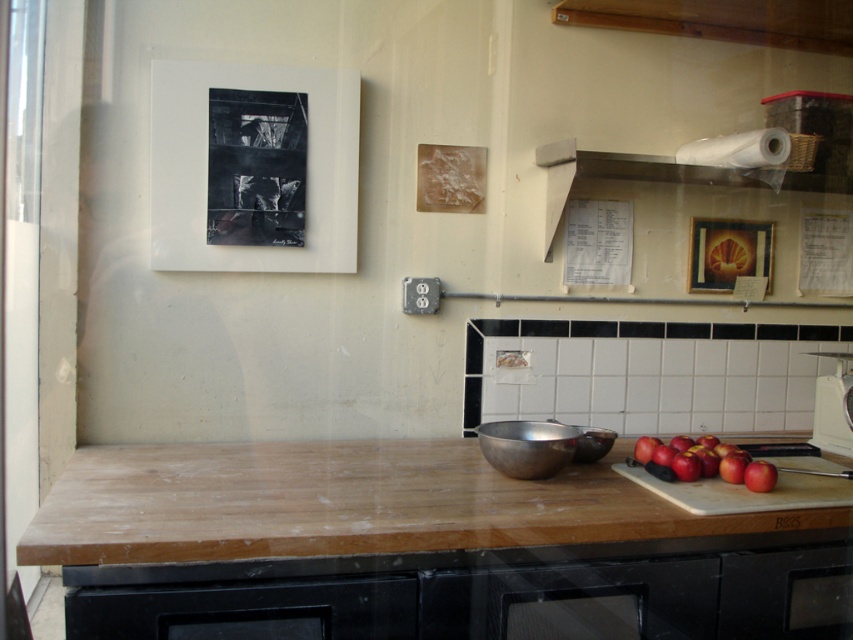
Can you confirm if red matte apples at lower right is taller than red matte apple at lower right?

Yes.

Can you confirm if red matte apples at lower right is positioned above red matte apple at lower right?

Indeed, red matte apples at lower right is positioned over red matte apple at lower right.

Does point (654, 445) come farther from viewer compared to point (752, 484)?

Yes, it is.

I want to click on red matte apples at lower right, so point(706,461).

Is white glossy scale at right to the left of red matte apple at lower right from the viewer's perspective?

In fact, white glossy scale at right is to the right of red matte apple at lower right.

Does white glossy scale at right have a smaller size compared to red matte apple at lower right?

Actually, white glossy scale at right might be larger than red matte apple at lower right.

Find the location of `white glossy scale at right`. white glossy scale at right is located at coordinates (833, 406).

Where is `white glossy scale at right`? white glossy scale at right is located at coordinates (833, 406).

Who is more distant from viewer, (320, 540) or (764, 477)?

Point (764, 477)

The height and width of the screenshot is (640, 853). What do you see at coordinates (347, 502) in the screenshot?
I see `wooden cutting board at center` at bounding box center [347, 502].

Does point (178, 476) come farther from viewer compared to point (747, 476)?

That is True.

Locate an element on the screen. wooden cutting board at center is located at coordinates (347, 502).